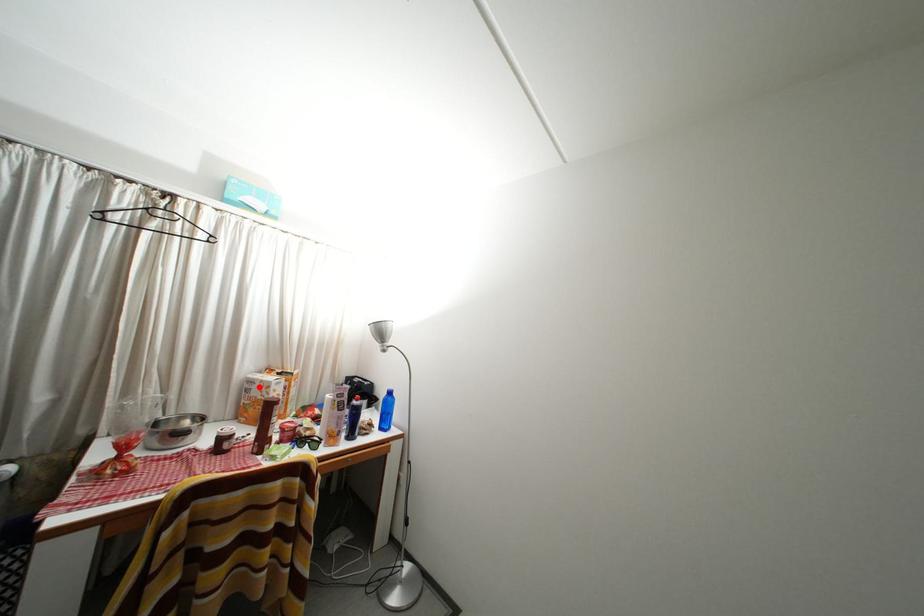
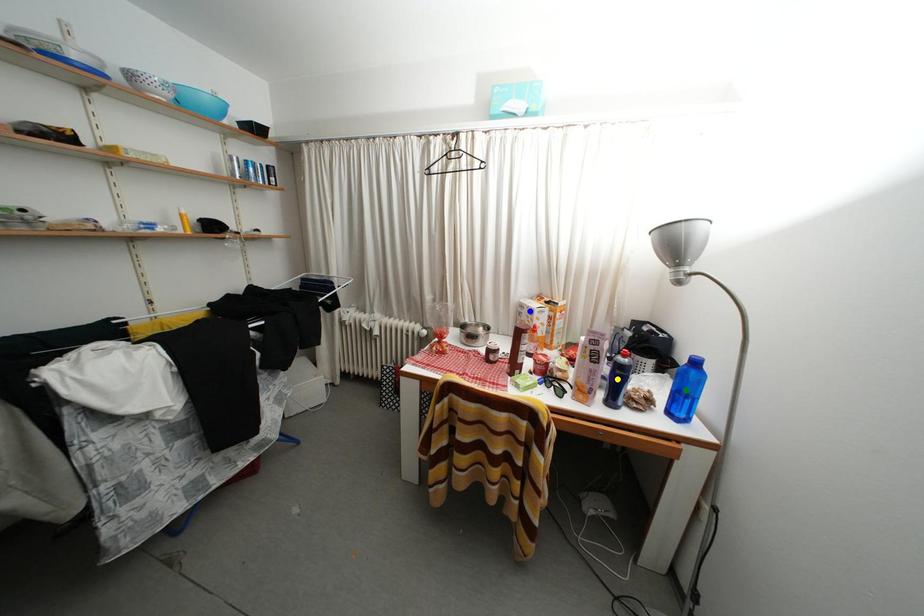
Question: I am providing you with two images of the same scene from different viewpoints. A red point is marked on the first image. You are given multiple points on the second image. Which mark in image 2 goes with the point in image 1?

Choices:
 (A) green point
 (B) yellow point
 (C) blue point

Answer: (C)